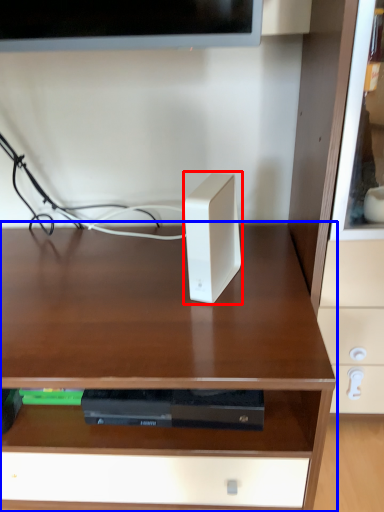
Question: Which object is further to the camera taking this photo, ipod (highlighted by a red box) or desk (highlighted by a blue box)?

Choices:
 (A) ipod
 (B) desk

Answer: (A)